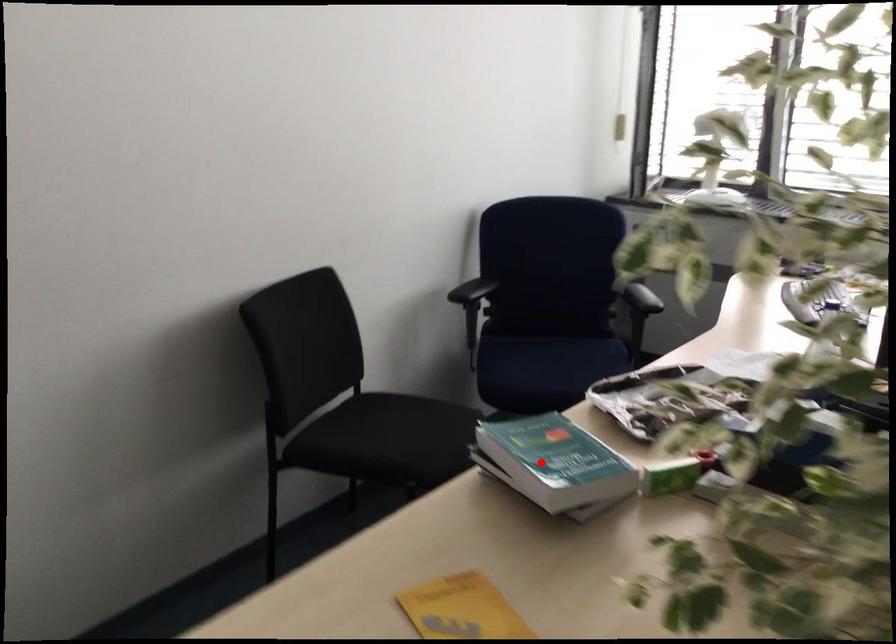
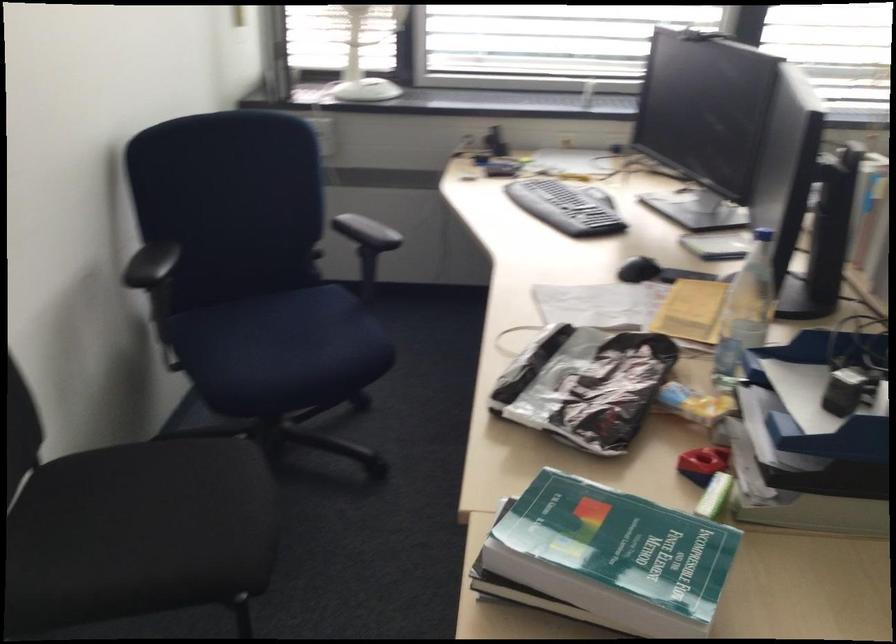
Question: A red point is marked in image1. In image2, is the corresponding 3D point closer to the camera or farther? Reply with the corresponding letter.

Choices:
 (A) The corresponding 3D point is closer.
 (B) The corresponding 3D point is farther.

Answer: (A)